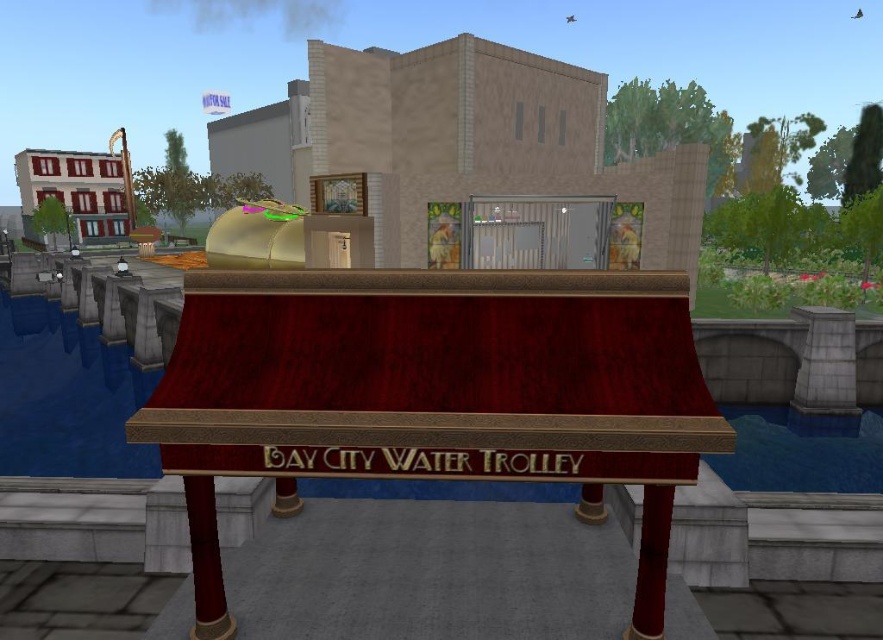
You are standing in the middle of the scene and want to walk towards the gray stone pillar at right and the shiny red wood pillar at lower right. Which pillar should you turn towards first?

You should turn towards the shiny red wood pillar at lower right first because the gray stone pillar at right is located to the right of the shiny red wood pillar at lower right, meaning the shiny red wood pillar is closer to your current position in the middle.

You are a delivery drone flying above the Bay City Water Trolley. You need to land on the ground between the blue water at lower left and the blue water at lower right. Is there enough space between them for your drone, which has a 40 feet wingspan, to land safely?

The blue water at lower left and blue water at lower right are 42.11 feet apart, so there is enough space for the drone with a 40 feet wingspan to land safely between them.

You are a character in this digital city and need to determine which pillar is taller to complete a quest. The gray stone pillar at right and the smooth red wood pillar at lower center are both in your line of sight. Which one is taller?

The gray stone pillar at right is taller than the smooth red wood pillar at lower center according to the description.